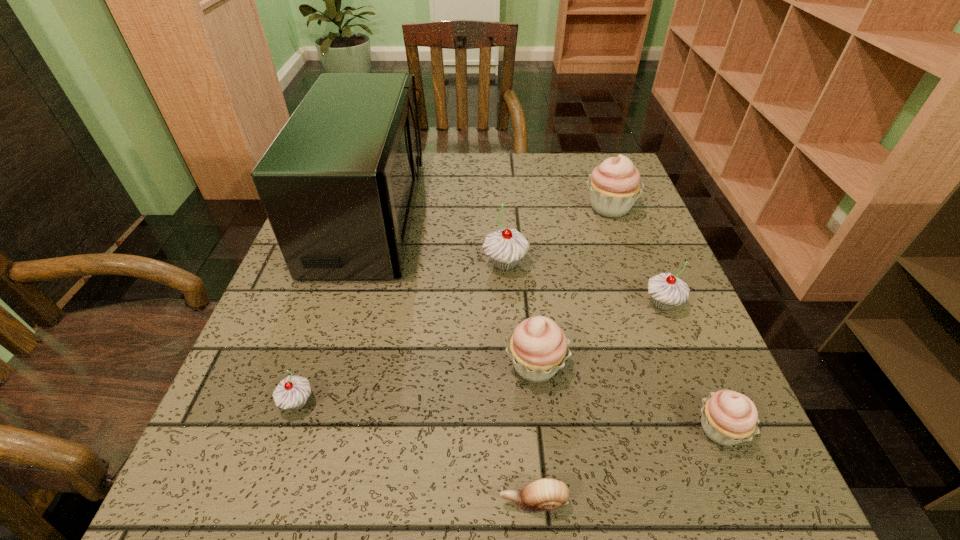
In order to click on grey microwave_oven in this screenshot , I will do `click(338, 184)`.

This screenshot has height=540, width=960. I want to click on microwave_oven, so click(338, 184).

You are a GUI agent. You are given a task and a screenshot of the screen. Output one action in this format:
    pyautogui.click(x=<x>, y=<y>)
    Task: Click on the biggest pink cupcake
    Image resolution: width=960 pixels, height=540 pixels.
    Given the screenshot: What is the action you would take?
    pyautogui.click(x=614, y=185)

You are a GUI agent. You are given a task and a screenshot of the screen. Output one action in this format:
    pyautogui.click(x=<x>, y=<y>)
    Task: Click on the farthest cupcake
    This screenshot has width=960, height=540.
    Given the screenshot: What is the action you would take?
    pyautogui.click(x=614, y=185)

Locate an element on the screen. The image size is (960, 540). the farthest gray cupcake is located at coordinates (505, 247).

Identify the location of the second farthest cupcake. Image resolution: width=960 pixels, height=540 pixels. (505, 247).

I want to click on the fourth nearest cupcake, so click(666, 290).

The width and height of the screenshot is (960, 540). Identify the location of the fifth nearest object. pos(666,290).

In order to click on the second smallest pink cupcake in this screenshot , I will do `click(538, 347)`.

This screenshot has height=540, width=960. In order to click on the second farthest pink cupcake in this screenshot , I will do `click(538, 347)`.